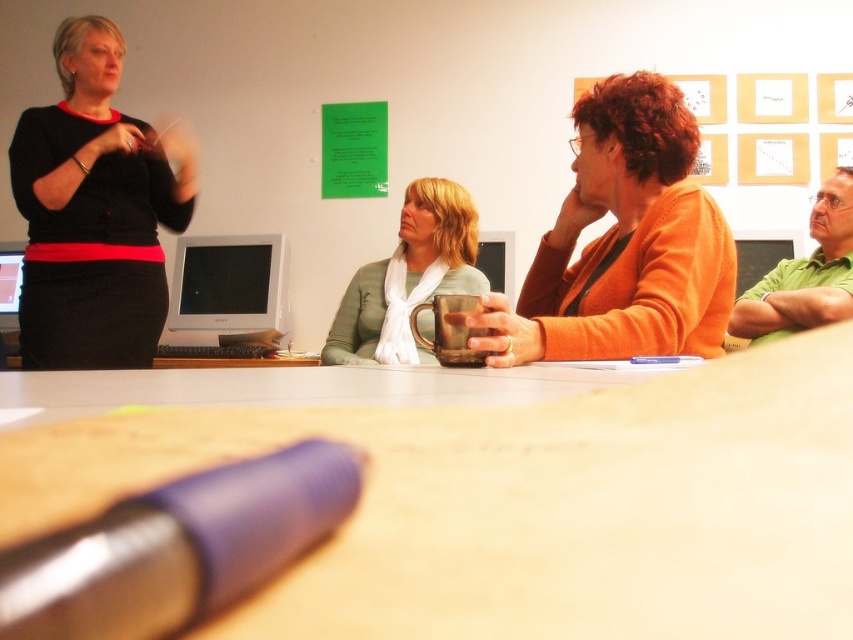
Question: Estimate the real-world distances between objects in this image. Which object is closer to the matte silver mug at center?

Choices:
 (A) orange matte sweater at center
 (B) matte black monitor at left
 (C) metallic blue pen at lower left
 (D) black matte sweater at upper left

Answer: (D)

Question: Is orange matte sweater at center to the right of black matte sweater at upper left from the viewer's perspective?

Choices:
 (A) no
 (B) yes

Answer: (B)

Question: Which object is the farthest from the matte black monitor at left?

Choices:
 (A) matte silver mug at center
 (B) smooth wooden table at center
 (C) matte gray monitor at center

Answer: (B)

Question: Does metallic blue pen at lower left appear on the left side of matte black monitor at left?

Choices:
 (A) yes
 (B) no

Answer: (B)

Question: Where is black matte sweater at upper left located in relation to matte silver mug at center in the image?

Choices:
 (A) above
 (B) below

Answer: (A)

Question: Which of the following is the farthest from the observer?

Choices:
 (A) smooth wooden table at center
 (B) matte black monitor at left
 (C) black matte sweater at upper left

Answer: (B)